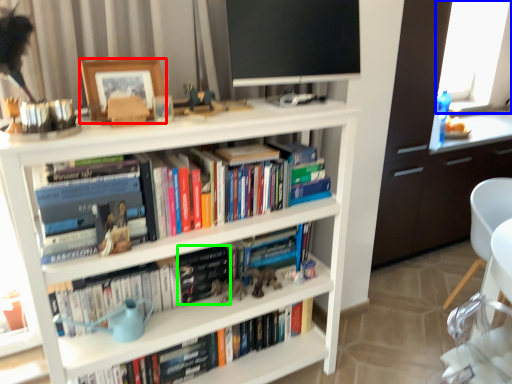
Question: Which object is positioned farthest from picture frame (highlighted by a red box)? Select from window screen (highlighted by a blue box) and paperback book (highlighted by a green box).

Choices:
 (A) window screen
 (B) paperback book

Answer: (A)